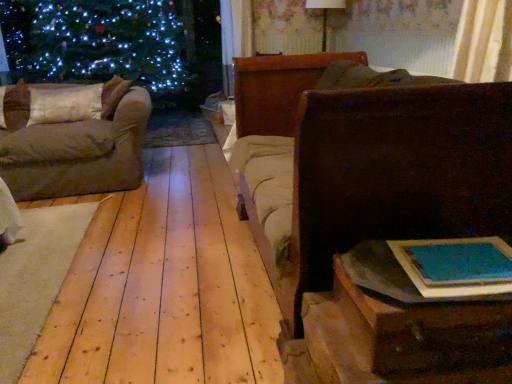
Question: From a real-world perspective, relative to white fabric pillow at left, is dark brown wood chest at right vertically above or below?

Choices:
 (A) above
 (B) below

Answer: (B)

Question: Is point (285, 122) positioned closer to the camera than point (80, 99)?

Choices:
 (A) farther
 (B) closer

Answer: (B)

Question: Estimate the real-world distances between objects in this image. Which object is farther from the blue paper book at lower right?

Choices:
 (A) white fabric pillow at left
 (B) wooden table at lower right
 (C) brown fabric couch at left
 (D) matte white lampshade at upper center
 (E) dark brown wood chest at right

Answer: (D)

Question: Which object is the closest to the blue paper book at lower right?

Choices:
 (A) white fabric pillow at left
 (B) wooden table at lower right
 (C) brown fabric couch at left
 (D) matte white lampshade at upper center
 (E) dark brown wood chest at right

Answer: (B)